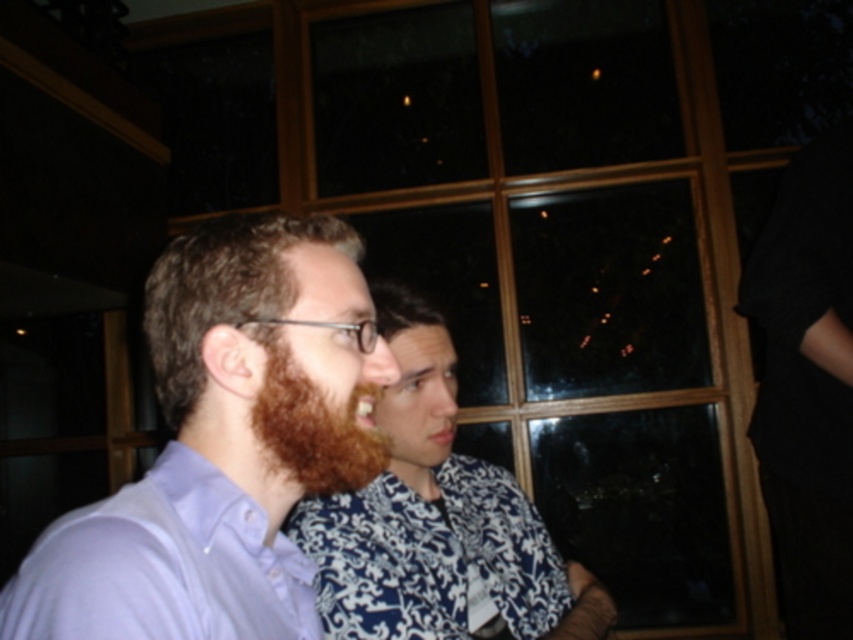
Question: Is matte purple shirt at center further to the viewer compared to brown fuzzy beard at center?

Choices:
 (A) no
 (B) yes

Answer: (A)

Question: Which of the following is the closest to the observer?

Choices:
 (A) (236, 547)
 (B) (126, 593)
 (C) (386, 474)

Answer: (B)

Question: Is matte purple shirt at center smaller than brown fuzzy beard at center?

Choices:
 (A) yes
 (B) no

Answer: (B)

Question: Which of the following is the closest to the observer?

Choices:
 (A) (287, 541)
 (B) (425, 326)
 (C) (314, 458)
 (D) (99, 636)

Answer: (D)

Question: Which of the following is the farthest from the observer?

Choices:
 (A) matte purple shirt at center
 (B) brown fuzzy beard at center
 (C) light purple cotton shirt at left
 (D) brown hair at center

Answer: (D)

Question: Where is brown hair at center located in relation to brown fuzzy beard at center in the image?

Choices:
 (A) below
 (B) above

Answer: (A)